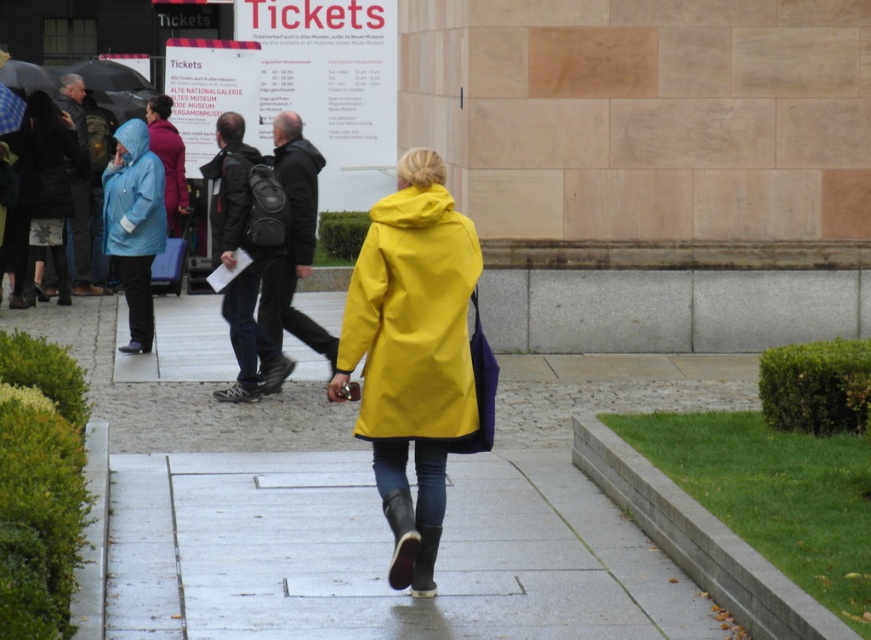
You are standing at the point labeled as point (244, 148) and want to walk towards the point labeled as point (356, 433). Which direction should you face to move towards it?

To move from point (244, 148) to point (356, 433), you should face towards the direction of the point (356, 433), which is closer to the camera than your current position. Since the point (356, 433) is closer to the camera, you need to walk towards the direction that is towards the camera from your current position.

You are standing in the rain at the museum entrance and see a person in a matte black coat at center and a black matte umbrella at upper left. Which object is providing shelter from the rain?

The black matte umbrella at upper left is providing shelter because it is positioned above the matte black coat at center.

You are standing at the entrance of the museum and see the smooth concrete pavement at center and the dark gray textured jacket at center. Which object is closer to you?

The dark gray textured jacket at center is closer to you because it is only 13.89 feet away from the smooth concrete pavement at center, so whichever is closer would depend on perspective, but according to the description, the distance between them is 13.89 feet. Wait, the description says the pavement is 13.89 feet away from the jacket. Since both are at center, perhaps the jacket is on the pavement, so the pavement is the surface. Hmm, maybe the question is which is closer to the observer. If the pavement